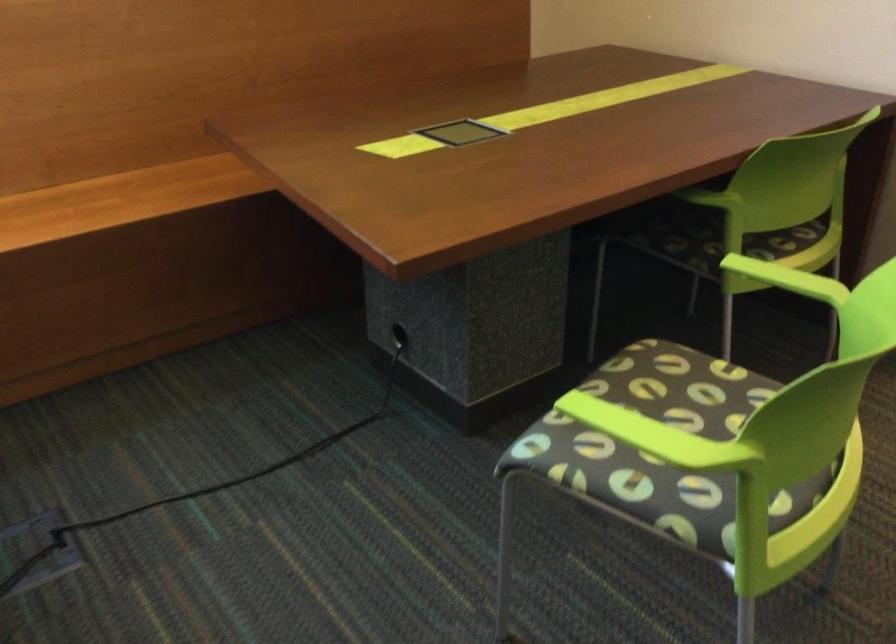
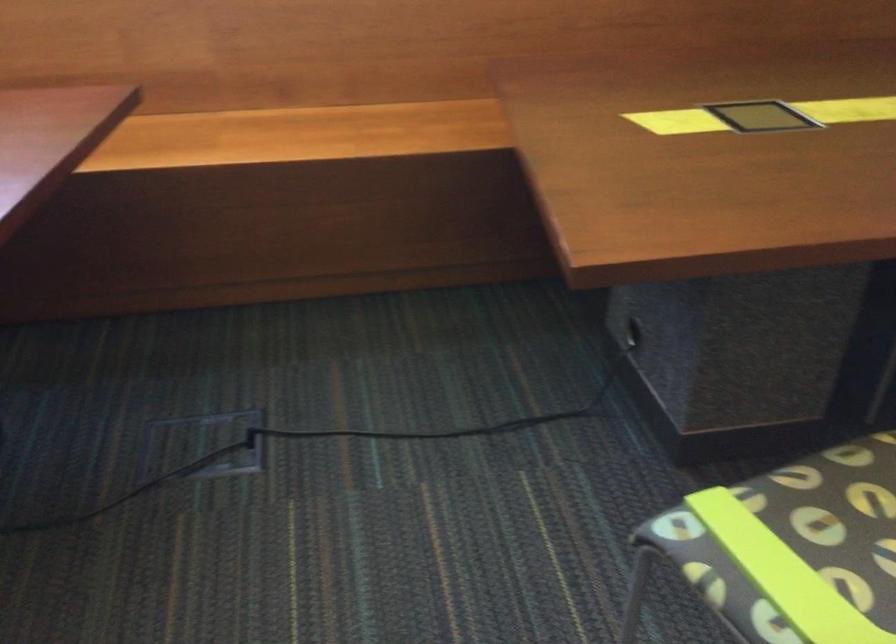
What movement of the cameraman would produce the second image?

The cameraman moved toward right, forward.